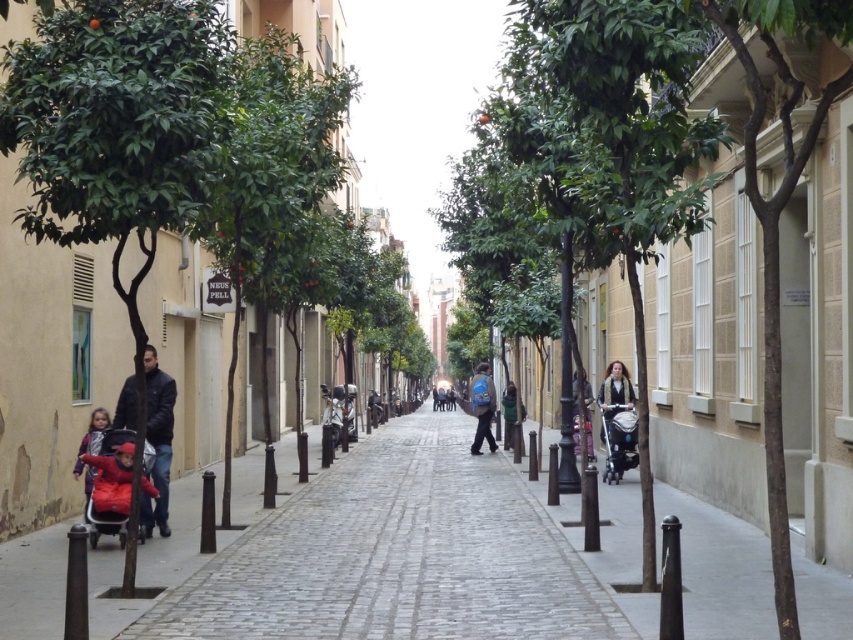
You are standing on the cobblestone street and want to locate the dark blue jacket at left. Where exactly is it located in terms of coordinates?

The dark blue jacket at left is located at coordinates point [157,440].

You are a photographer standing on the cobblestone street and want to capture both the dark blue jacket at left and the red fabric baby carriage at lower left in a single photo. Since your camera can only focus on one object at a time, which object should you prioritize focusing on to ensure the other remains in the background?

Since the dark blue jacket at left is bigger than the red fabric baby carriage at lower left, you should focus on the dark blue jacket at left to keep the smaller red fabric baby carriage at lower left in the background.

You are standing at the point with coordinates point (442, 403) and want to walk to the point with coordinates point (630, 449). Which direction should you move to reach your destination?

You should move forward because point (630, 449) is in front of point (442, 403).